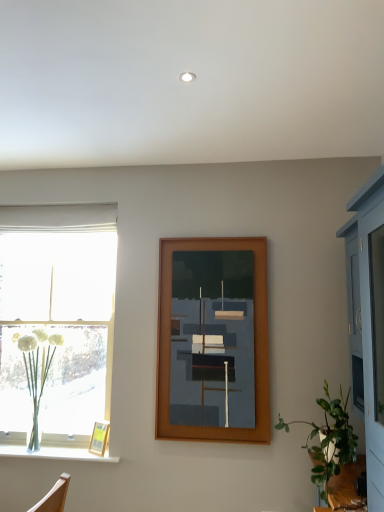
Question: Is white fabric curtain at left bigger or smaller than green leafy plant at lower right?

Choices:
 (A) small
 (B) big

Answer: (A)

Question: From their relative heights in the image, would you say white fabric curtain at left is taller or shorter than green leafy plant at lower right?

Choices:
 (A) short
 (B) tall

Answer: (A)

Question: Estimate the real-world distances between objects in this image. Which object is closer to the wooden picture frame at lower left, positioned as the first picture frame in bottom-to-top order?

Choices:
 (A) white fabric curtain at left
 (B) green leafy plant at lower right
 (C) clear glass vase at lower left
 (D) clear glass vase at left
 (E) wooden picture frame at center, the second picture frame in the bottom-to-top sequence

Answer: (C)

Question: Based on their relative distances, which object is farther from the wooden picture frame at lower left, placed as the first picture frame when sorted from left to right?

Choices:
 (A) clear glass vase at lower left
 (B) wooden picture frame at center, which appears as the first picture frame when viewed from the right
 (C) white fabric curtain at left
 (D) green leafy plant at lower right
 (E) clear glass vase at left

Answer: (C)